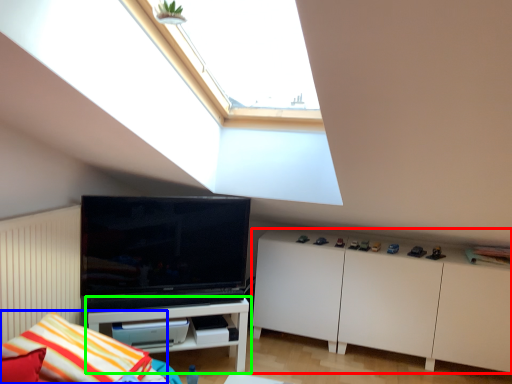
Question: Estimate the real-world distances between objects in this image. Which object is farther from cabinetry (highlighted by a red box), pillow (highlighted by a blue box) or shelf (highlighted by a green box)?

Choices:
 (A) pillow
 (B) shelf

Answer: (A)